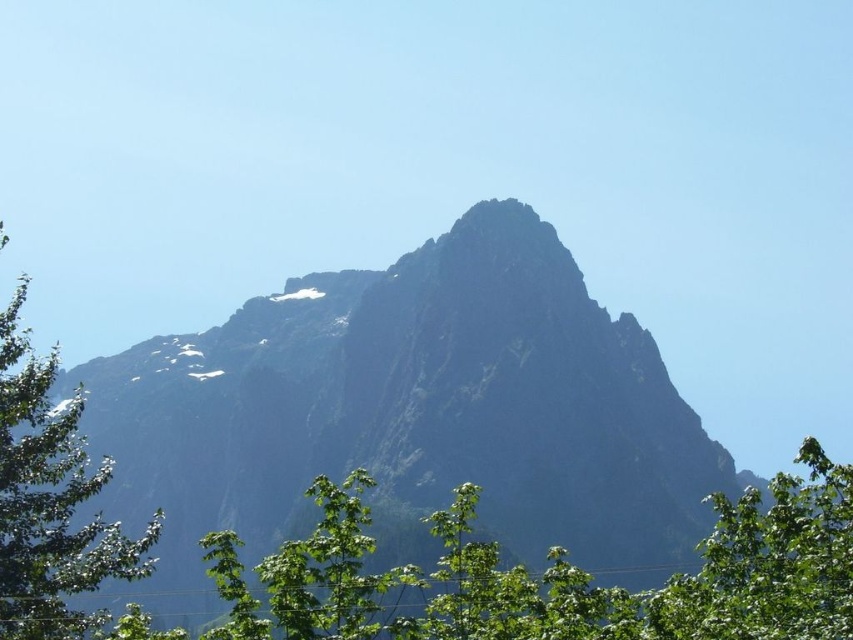
You are an observer standing in front of the scene. Which object is positioned lower in the image, the rugged stone mountain at center or the green leafy tree at left?

The rugged stone mountain at center is located below the green leafy tree at left, so the rugged stone mountain at center is positioned lower in the image.

Consider the image. You are standing at the base of the mountain and see the point marked at coordinates (x=50, y=500). Which object in the scene does this point correspond to?

The point at coordinates (x=50, y=500) is on the green leafy tree at left.